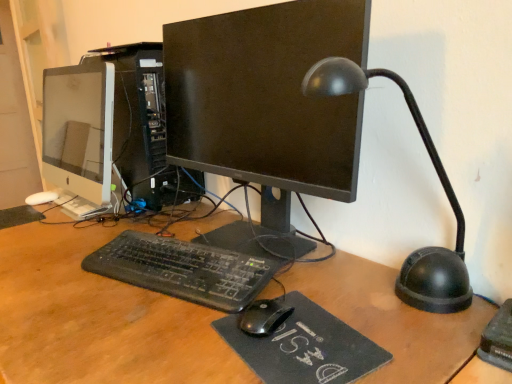
Question: Can you confirm if black matte monitor at center, which appears as the 2th computer monitor when viewed from the left, is bigger than black plastic table lamp at right?

Choices:
 (A) no
 (B) yes

Answer: (B)

Question: Is black matte monitor at center, which appears as the 2th computer monitor when viewed from the left, facing away from black plastic table lamp at right?

Choices:
 (A) yes
 (B) no

Answer: (B)

Question: Can you confirm if black matte monitor at center, which is counted as the 1th computer monitor, starting from the right, is smaller than black plastic table lamp at right?

Choices:
 (A) yes
 (B) no

Answer: (B)

Question: Would you consider black matte monitor at center, which is counted as the 1th computer monitor, starting from the right, to be distant from black plastic table lamp at right?

Choices:
 (A) no
 (B) yes

Answer: (A)

Question: Is black plastic table lamp at right inside black matte monitor at center, which is counted as the 1th computer monitor, starting from the right?

Choices:
 (A) no
 (B) yes

Answer: (A)

Question: Is black plastic keyboard at center taller or shorter than black felt mousepad at center?

Choices:
 (A) short
 (B) tall

Answer: (B)

Question: Visually, is black plastic keyboard at center positioned to the left or to the right of black felt mousepad at center?

Choices:
 (A) right
 (B) left

Answer: (B)

Question: Does point (228, 301) appear closer or farther from the camera than point (287, 294)?

Choices:
 (A) closer
 (B) farther

Answer: (B)

Question: Choose the correct answer: Is black plastic keyboard at center inside black felt mousepad at center or outside it?

Choices:
 (A) outside
 (B) inside

Answer: (A)

Question: Does point (160, 251) appear closer or farther from the camera than point (254, 241)?

Choices:
 (A) closer
 (B) farther

Answer: (A)

Question: From the image's perspective, is black plastic keyboard at center above or below black matte monitor at center, which appears as the 2th computer monitor when viewed from the left?

Choices:
 (A) below
 (B) above

Answer: (A)

Question: Would you say black plastic keyboard at center is inside or outside black matte monitor at center, which appears as the 2th computer monitor when viewed from the left?

Choices:
 (A) outside
 (B) inside

Answer: (A)

Question: In terms of size, does black plastic keyboard at center appear bigger or smaller than black matte monitor at center, which appears as the 2th computer monitor when viewed from the left?

Choices:
 (A) big
 (B) small

Answer: (B)

Question: Is white glossy monitor at left, the first computer monitor in the left-to-right sequence, taller or shorter than black plastic table lamp at right?

Choices:
 (A) tall
 (B) short

Answer: (A)

Question: In terms of width, does white glossy monitor at left, acting as the second computer monitor starting from the right, look wider or thinner when compared to black plastic table lamp at right?

Choices:
 (A) wide
 (B) thin

Answer: (B)